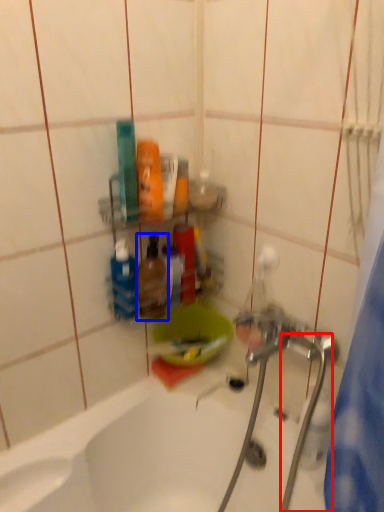
Question: Which of the following is the closest to the observer, water pipe (highlighted by a red box) or mouthwash (highlighted by a blue box)?

Choices:
 (A) water pipe
 (B) mouthwash

Answer: (A)